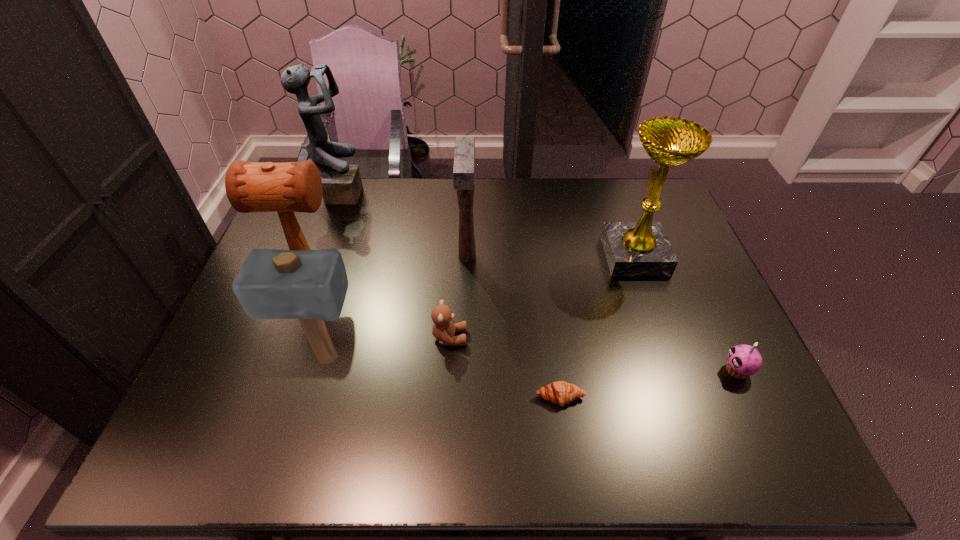
Locate an element on the screen. Image resolution: width=960 pixels, height=540 pixels. sculpture at the left edge is located at coordinates (341, 183).

Find the location of `mallet present at the left edge`. mallet present at the left edge is located at coordinates (285, 188).

Image resolution: width=960 pixels, height=540 pixels. What are the coordinates of `award at the right edge` in the screenshot? It's located at (642, 248).

The width and height of the screenshot is (960, 540). In order to click on cupcake positioned at the right edge in this screenshot , I will do `click(743, 360)`.

At what (x,y) coordinates should I click in order to perform the action: click on object that is positioned at the far left corner. Please return your answer as a coordinate pair (x, y). Looking at the image, I should click on 341,183.

In the image, there is a desktop. Find the location of `vacant space at the far edge`. vacant space at the far edge is located at coordinates (537, 195).

In the image, there is a desktop. In order to click on vacant area at the near edge in this screenshot , I will do (x=687, y=445).

Identify the location of vacant region at the right edge of the desktop. The image size is (960, 540). (711, 303).

You are a GUI agent. You are given a task and a screenshot of the screen. Output one action in this format:
    pyautogui.click(x=<x>, y=<y>)
    Task: Click on the unoccupied area between the award and the teddy bear
    This screenshot has height=540, width=960.
    Given the screenshot: What is the action you would take?
    pyautogui.click(x=542, y=296)

This screenshot has width=960, height=540. In order to click on empty space that is in between the second object from right to left and the pastry in this screenshot , I will do `click(597, 327)`.